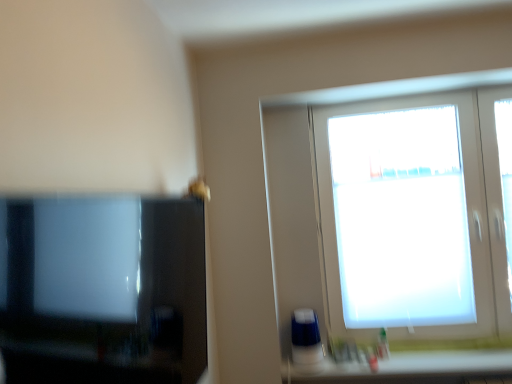
This screenshot has height=384, width=512. Identify the location of spots to the right of translucent plastic bottle at lower right. (412, 359).